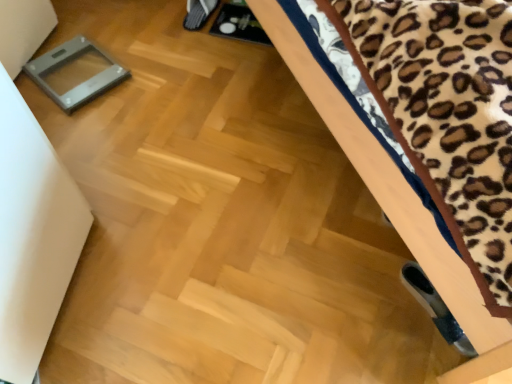
This screenshot has width=512, height=384. I want to click on wooden bed frame at upper right, so click(392, 182).

What do you see at coordinates (392, 182) in the screenshot? Image resolution: width=512 pixels, height=384 pixels. I see `wooden bed frame at upper right` at bounding box center [392, 182].

Where is `wooden bed frame at upper right`? This screenshot has height=384, width=512. wooden bed frame at upper right is located at coordinates (392, 182).